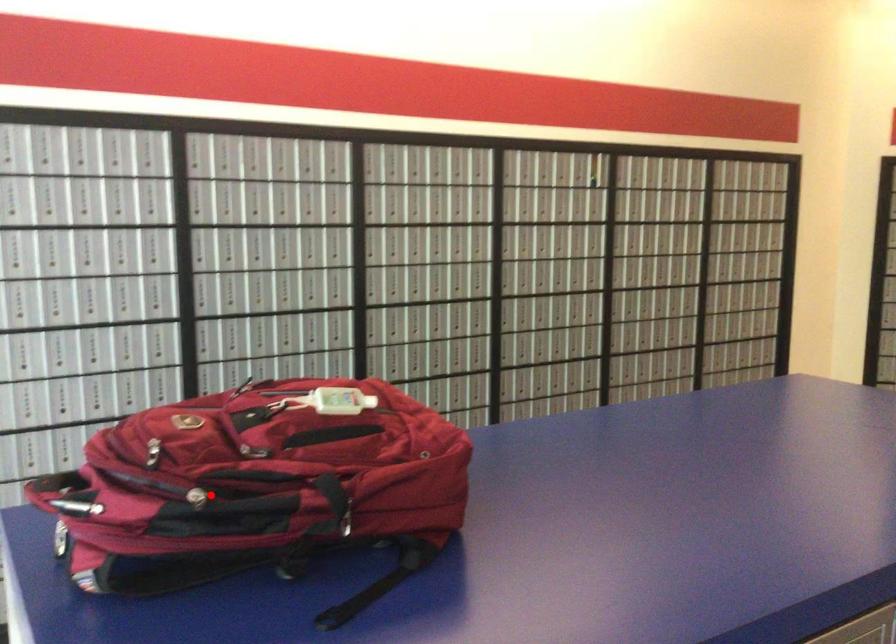
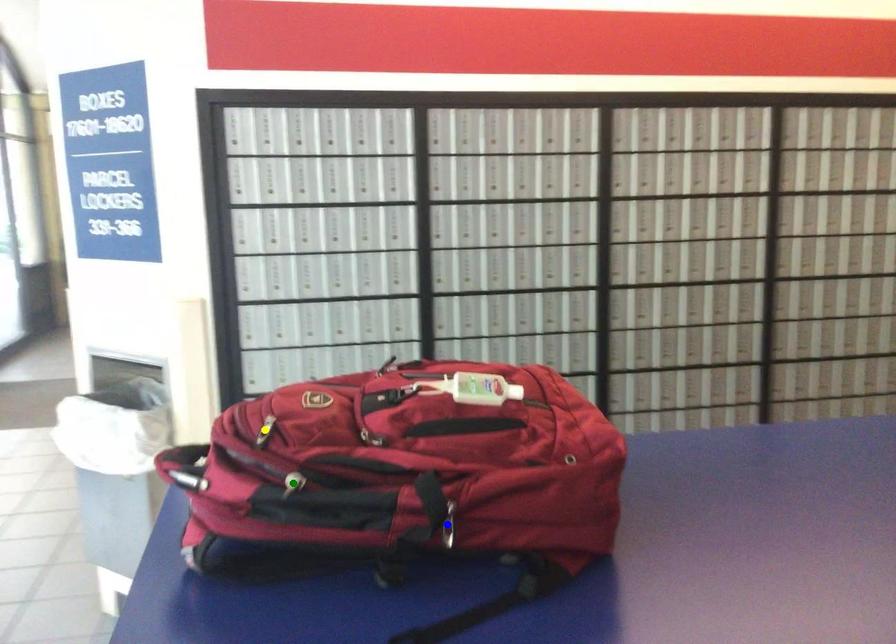
Question: I am providing you with two images of the same scene from different viewpoints. A red point is marked on the first image. You are given multiple points on the second image. Can you choose the point in image 2 that corresponds to the point in image 1?

Choices:
 (A) blue point
 (B) green point
 (C) yellow point

Answer: (B)